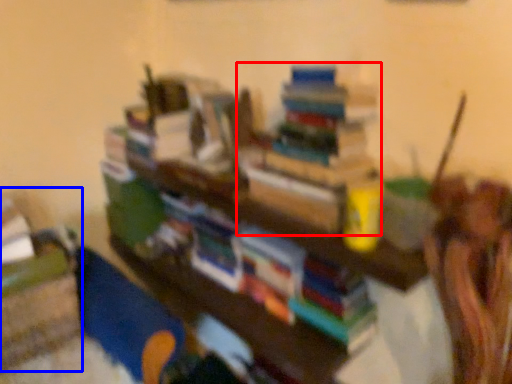
Question: Which point is closer to the camera, book (highlighted by a red box) or shelf (highlighted by a blue box)?

Choices:
 (A) book
 (B) shelf

Answer: (A)